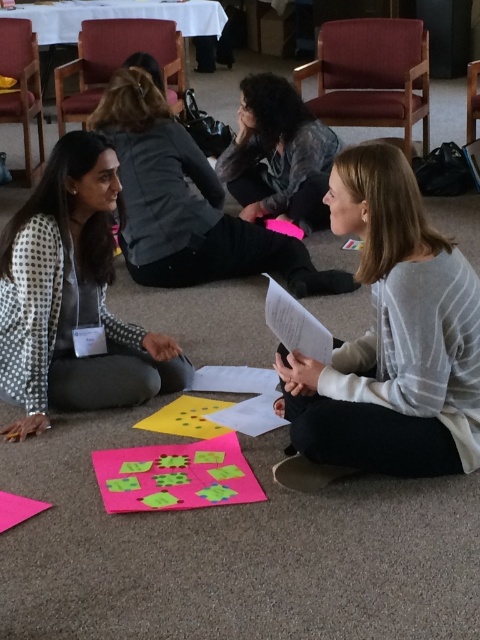
You are a photographer trying to capture the two women at the center of the scene. You notice that the matte gray sweater at center and the dark gray sweater at center are positioned in a way that might block each other. Which sweater should you adjust to ensure both are fully visible in the photo?

The matte gray sweater at center is below the dark gray sweater at center, so you should adjust the dark gray sweater at center to move it upwards to allow both sweaters to be fully visible.

You are organizing a small event and need to seat two guests wearing the gray striped sweater at center and the white dotted blazer at left. If you want to arrange chairs so that the larger garment doesn not block the smaller one, where should you place the chairs?

Since the gray striped sweater at center is larger than the white dotted blazer at left, you should place the chair for the gray striped sweater at center behind the chair for the white dotted blazer at left to prevent blocking.